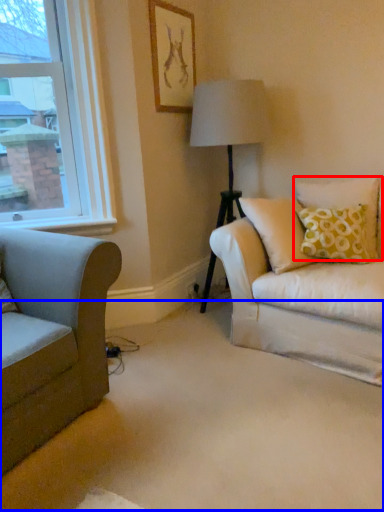
Question: Which point is further to the camera, pillow (highlighted by a red box) or plain (highlighted by a blue box)?

Choices:
 (A) pillow
 (B) plain

Answer: (A)